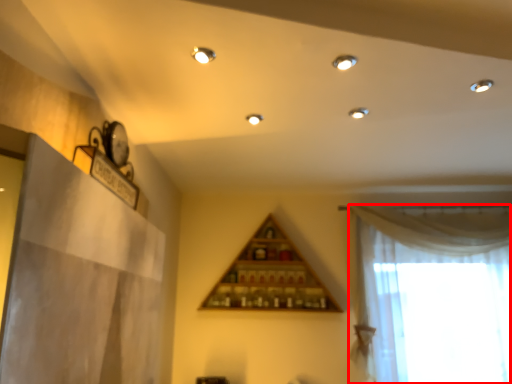
Question: From the image's perspective, where is curtain (annotated by the red box) located relative to shelf?

Choices:
 (A) above
 (B) below

Answer: (B)